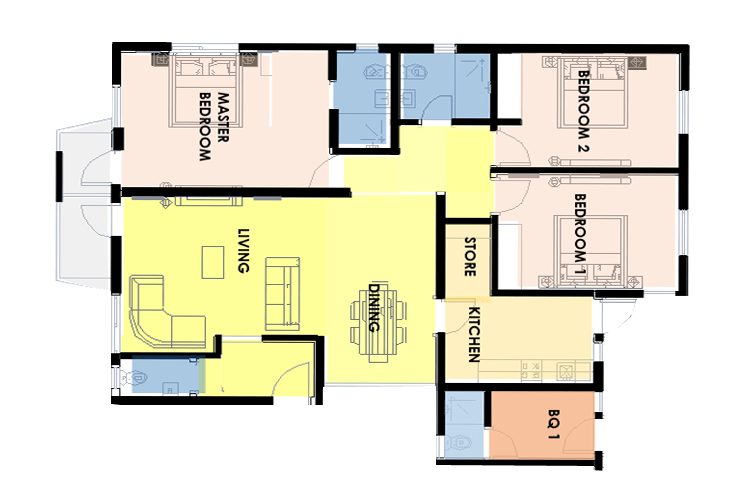
The image size is (750, 500). I want to click on basin, so click(x=381, y=97), click(x=408, y=97).